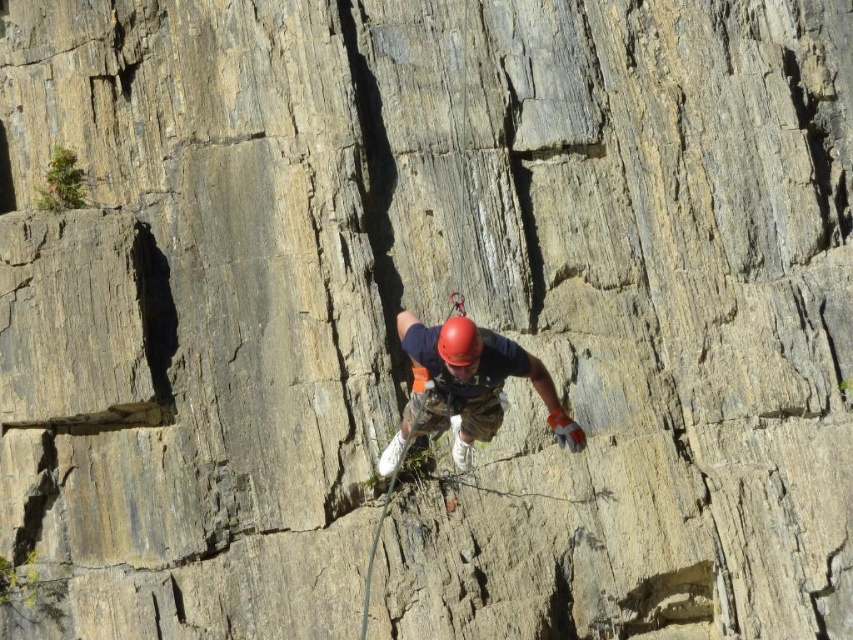
You are a photographer taking a picture of the rock climber. You notice the matte blue shirt at center and the red matte helmet at center. Which object appears wider in the photo?

The matte blue shirt at center appears wider than the red matte helmet at center because the matte blue shirt at center has a greater width according to the description.

You are a photographer aiming to capture the climber from a position where both the matte blue shirt at center and the red matte helmet at center are visible. Which object should you focus on first to ensure both are in frame?

The matte blue shirt at center has a lesser height compared to the red matte helmet at center, so you should focus on the red matte helmet at center first to ensure both are in frame.

You are a drone operator trying to capture the climber wearing the matte blue shirt at center. The drone is currently at point A. To get the best shot, you need to adjust the drone to point B. What is the direction you should move the drone to reach point B from point A?

The question cannot be answered with the provided information because the coordinates of point A and point B are not specified in the scene description.